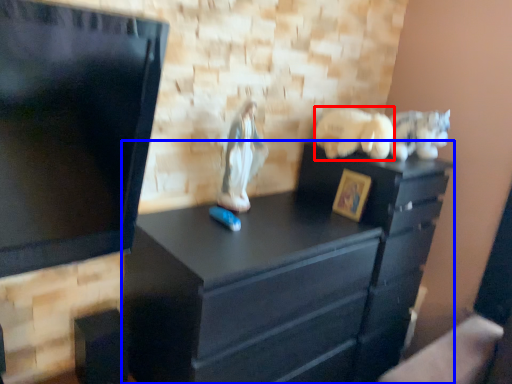
Question: Among these objects, which one is nearest to the camera, animal (highlighted by a red box) or chest of drawers (highlighted by a blue box)?

Choices:
 (A) animal
 (B) chest of drawers

Answer: (B)